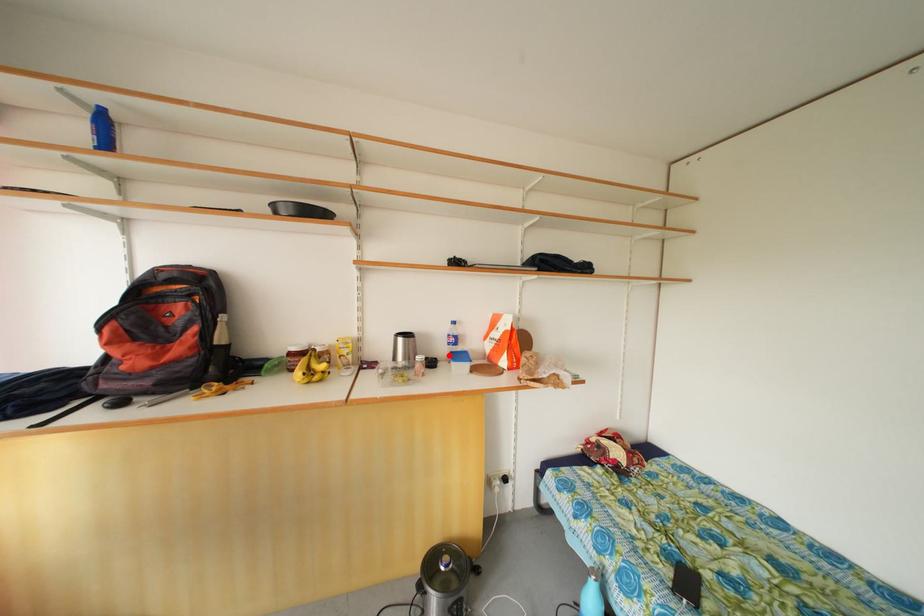
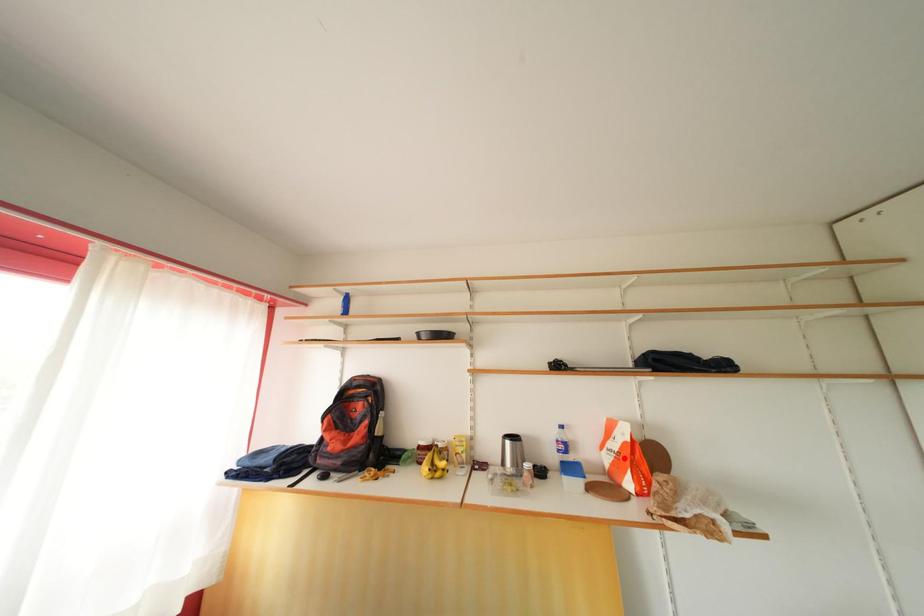
I am providing you with two images of the same scene from different viewpoints. A red point is marked on the first image and another point is marked on the second image. Is the marked point in image1 the same physical position as the marked point in image2?

No